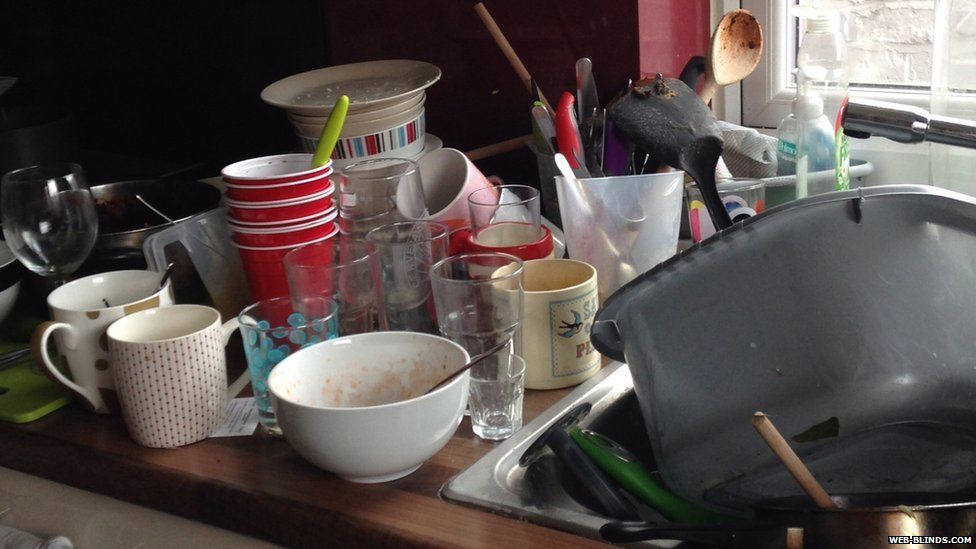
Where is `wine glass`? wine glass is located at coordinates (59, 221).